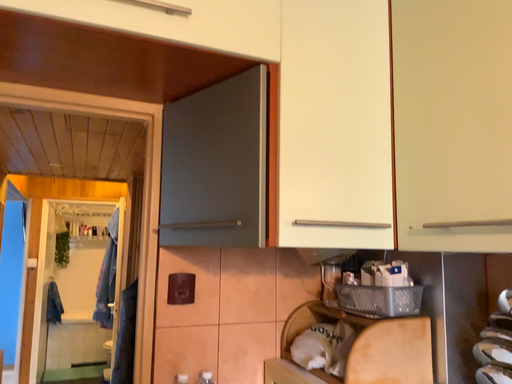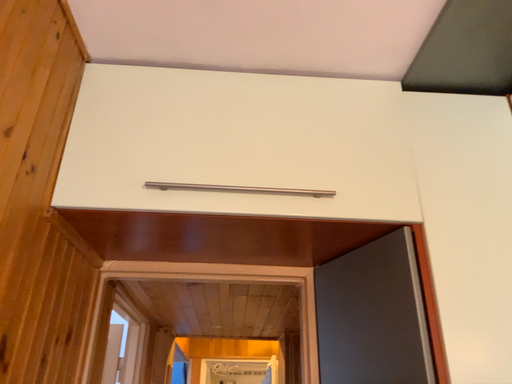
Question: Which way did the camera rotate in the video?

Choices:
 (A) rotated left
 (B) rotated right

Answer: (A)